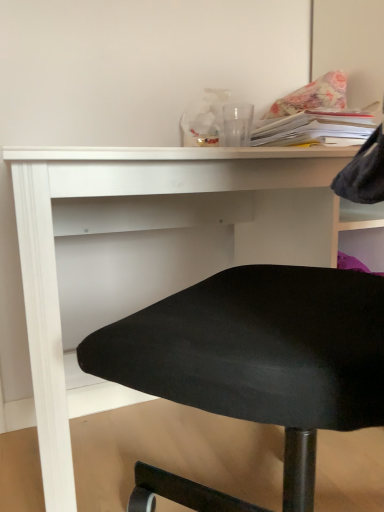
Question: Is white paper stack at upper right surrounding floral fabric pillow at upper right?

Choices:
 (A) yes
 (B) no

Answer: (B)

Question: From a real-world perspective, is white paper stack at upper right located beneath floral fabric pillow at upper right?

Choices:
 (A) yes
 (B) no

Answer: (A)

Question: Considering the relative sizes of white paper stack at upper right and floral fabric pillow at upper right in the image provided, is white paper stack at upper right shorter than floral fabric pillow at upper right?

Choices:
 (A) no
 (B) yes

Answer: (B)

Question: Is white paper stack at upper right smaller than floral fabric pillow at upper right?

Choices:
 (A) no
 (B) yes

Answer: (B)

Question: Does white paper stack at upper right lie in front of floral fabric pillow at upper right?

Choices:
 (A) yes
 (B) no

Answer: (A)

Question: From a real-world perspective, is floral fabric pillow at upper right above or below white matte desk at center?

Choices:
 (A) below
 (B) above

Answer: (B)

Question: Is floral fabric pillow at upper right bigger or smaller than white matte desk at center?

Choices:
 (A) small
 (B) big

Answer: (A)

Question: From the image's perspective, is floral fabric pillow at upper right positioned above or below white matte desk at center?

Choices:
 (A) below
 (B) above

Answer: (B)

Question: Is floral fabric pillow at upper right taller or shorter than white matte desk at center?

Choices:
 (A) tall
 (B) short

Answer: (B)

Question: Does point 294,100 appear closer or farther from the camera than point 311,117?

Choices:
 (A) farther
 (B) closer

Answer: (A)

Question: Is floral fabric pillow at upper right inside the boundaries of white paper stack at upper right, or outside?

Choices:
 (A) outside
 (B) inside

Answer: (A)

Question: Based on their sizes in the image, would you say floral fabric pillow at upper right is bigger or smaller than white paper stack at upper right?

Choices:
 (A) small
 (B) big

Answer: (B)

Question: Considering the positions of floral fabric pillow at upper right and white paper stack at upper right in the image, is floral fabric pillow at upper right taller or shorter than white paper stack at upper right?

Choices:
 (A) tall
 (B) short

Answer: (A)

Question: From the image's perspective, is white matte desk at center positioned above or below floral fabric pillow at upper right?

Choices:
 (A) below
 (B) above

Answer: (A)

Question: From a real-world perspective, is white matte desk at center physically located above or below floral fabric pillow at upper right?

Choices:
 (A) below
 (B) above

Answer: (A)